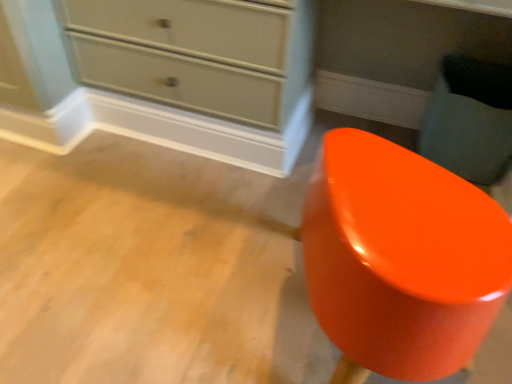
What is the approximate width of glossy orange stool at lower right?

glossy orange stool at lower right is 19.27 inches in width.

What do you see at coordinates (401, 258) in the screenshot? I see `glossy orange stool at lower right` at bounding box center [401, 258].

Image resolution: width=512 pixels, height=384 pixels. Identify the location of glossy orange stool at lower right. (401, 258).

In order to click on glossy orange stool at lower right in this screenshot , I will do `click(470, 119)`.

Describe the element at coordinates (470, 119) in the screenshot. I see `glossy orange stool at lower right` at that location.

Identify the location of glossy orange stool at lower right. This screenshot has height=384, width=512. (401, 258).

Between glossy orange stool at lower right and glossy orange stool at lower right, which one appears on the right side from the viewer's perspective?

From the viewer's perspective, glossy orange stool at lower right appears more on the right side.

From the picture: In the image, is glossy orange stool at lower right positioned in front of or behind glossy orange stool at lower right?

glossy orange stool at lower right is in front of glossy orange stool at lower right.

Which is in front, point (317, 234) or point (470, 173)?

The point (317, 234) is closer to the camera.

From the image's perspective, which one is positioned lower, glossy orange stool at lower right or glossy orange stool at lower right?

glossy orange stool at lower right is shown below in the image.

From a real-world perspective, is glossy orange stool at lower right physically below glossy orange stool at lower right?

No, from a real-world perspective, glossy orange stool at lower right is not under glossy orange stool at lower right.

Considering the sizes of objects glossy orange stool at lower right and glossy orange stool at lower right in the image provided, who is thinner, glossy orange stool at lower right or glossy orange stool at lower right?

glossy orange stool at lower right.

Can you confirm if glossy orange stool at lower right is shorter than glossy orange stool at lower right?

No.

Between glossy orange stool at lower right and glossy orange stool at lower right, which one has larger size?

glossy orange stool at lower right is bigger.

Is glossy orange stool at lower right positioned beyond the bounds of glossy orange stool at lower right?

Yes.

Is glossy orange stool at lower right far away from glossy orange stool at lower right?

Actually, glossy orange stool at lower right and glossy orange stool at lower right are a little close together.

Could you tell me if glossy orange stool at lower right is facing glossy orange stool at lower right?

Yes.

How many degrees apart are the facing directions of glossy orange stool at lower right and glossy orange stool at lower right?

177 degrees.

How much distance is there between glossy orange stool at lower right and glossy orange stool at lower right?

28.21 inches.

Locate an element on the screen. This screenshot has width=512, height=384. furniture below the glossy orange stool at lower right (from the image's perspective) is located at coordinates (401, 258).

Considering the relative positions of glossy orange stool at lower right and glossy orange stool at lower right in the image provided, is glossy orange stool at lower right to the left or to the right of glossy orange stool at lower right?

Based on their positions, glossy orange stool at lower right is located to the right of glossy orange stool at lower right.

Considering the positions of objects glossy orange stool at lower right and glossy orange stool at lower right in the image provided, who is behind, glossy orange stool at lower right or glossy orange stool at lower right?

Positioned behind is glossy orange stool at lower right.

Does point (486, 165) appear closer or farther from the camera than point (341, 277)?

Point (486, 165).

From the image's perspective, is glossy orange stool at lower right over glossy orange stool at lower right?

Yes, from the image's perspective, glossy orange stool at lower right is over glossy orange stool at lower right.

From a real-world perspective, which object rests below the other?

In real-world perspective, glossy orange stool at lower right is lower.

Which of these two, glossy orange stool at lower right or glossy orange stool at lower right, is wider?

With larger width is glossy orange stool at lower right.

Which of these two, glossy orange stool at lower right or glossy orange stool at lower right, stands taller?

glossy orange stool at lower right.

Who is smaller, glossy orange stool at lower right or glossy orange stool at lower right?

With smaller size is glossy orange stool at lower right.

Is glossy orange stool at lower right not inside glossy orange stool at lower right?

Absolutely, glossy orange stool at lower right is external to glossy orange stool at lower right.

Is glossy orange stool at lower right far from glossy orange stool at lower right?

Actually, glossy orange stool at lower right and glossy orange stool at lower right are a little close together.

Could you tell me if glossy orange stool at lower right is turned towards glossy orange stool at lower right?

Yes, glossy orange stool at lower right faces towards glossy orange stool at lower right.

Can you tell me how much glossy orange stool at lower right and glossy orange stool at lower right differ in facing direction?

177 degrees separate the facing orientations of glossy orange stool at lower right and glossy orange stool at lower right.

Identify the location of furniture lying in front of the glossy orange stool at lower right. (401, 258).

In the image, there is a glossy orange stool at lower right. Where is `swivel chair below it (from a real-world perspective)`? swivel chair below it (from a real-world perspective) is located at coordinates (470, 119).

Where is `furniture that appears in front of the glossy orange stool at lower right`? This screenshot has width=512, height=384. furniture that appears in front of the glossy orange stool at lower right is located at coordinates (401, 258).